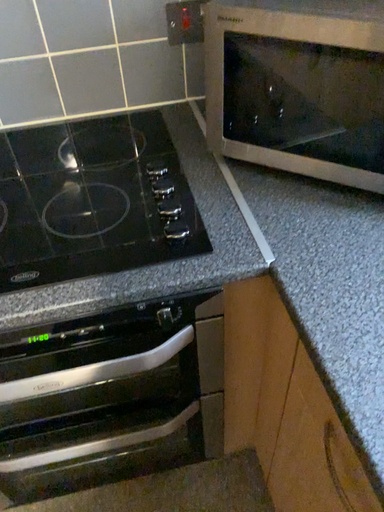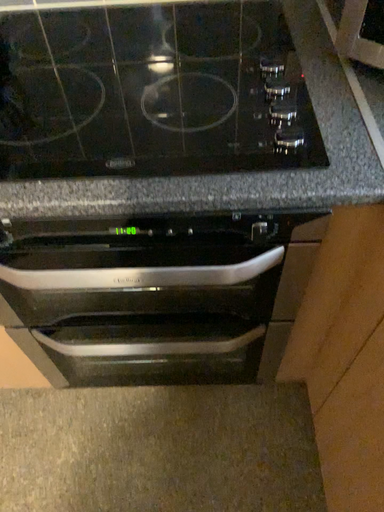
Question: How did the camera likely rotate when shooting the video?

Choices:
 (A) rotated right
 (B) rotated left

Answer: (B)